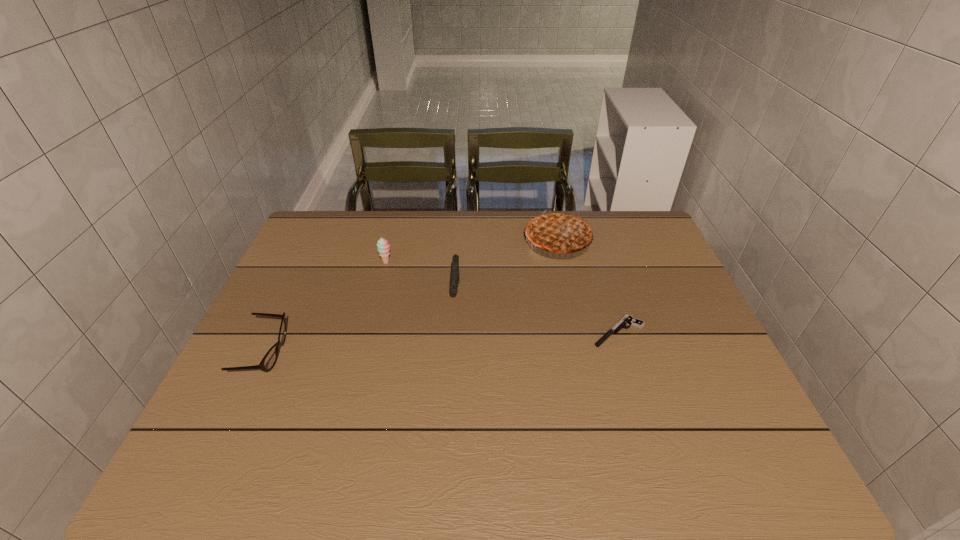
This screenshot has width=960, height=540. Find the location of `vacant area that lies between the third farthest object and the spectacles`. vacant area that lies between the third farthest object and the spectacles is located at coordinates (360, 323).

Identify the location of free space between the taller pistol and the second object from left to right. (421, 278).

Locate an element on the screen. vacant space in between the sherbert and the left pistol is located at coordinates (421, 278).

Point out which object is positioned as the second nearest to the second object from left to right. Please provide its 2D coordinates. Your answer should be formatted as a tuple, i.e. [(x, y)], where the tuple contains the x and y coordinates of a point satisfying the conditions above.

[(269, 360)]

Locate an element on the screen. The image size is (960, 540). object that is the closest to the fourth tallest object is located at coordinates (383, 247).